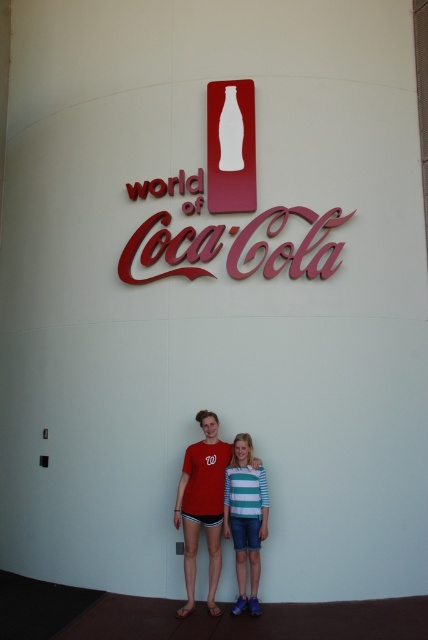
Is the position of red cotton t-shirt at center more distant than that of striped cotton shirt at center?

No, it is in front of striped cotton shirt at center.

Describe the element at coordinates (202, 506) in the screenshot. This screenshot has width=428, height=640. I see `red cotton t-shirt at center` at that location.

Does point (211, 522) come farther from viewer compared to point (259, 492)?

Yes, it is.

You are a GUI agent. You are given a task and a screenshot of the screen. Output one action in this format:
    pyautogui.click(x=<x>, y=<y>)
    Task: Click on the red cotton t-shirt at center
    This screenshot has width=428, height=640.
    Given the screenshot: What is the action you would take?
    pyautogui.click(x=202, y=506)